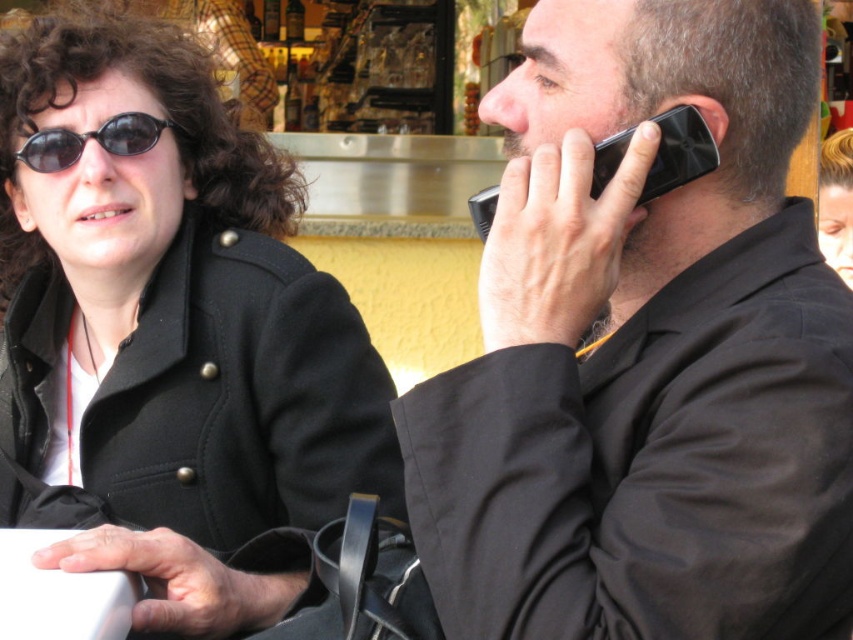
What do you see at coordinates (170, 333) in the screenshot? The height and width of the screenshot is (640, 853). I see `black wool coat at upper left` at bounding box center [170, 333].

Between black wool coat at upper left and black plastic sunglasses at upper left, which one is positioned lower?

black wool coat at upper left is below.

This screenshot has width=853, height=640. Describe the element at coordinates (170, 333) in the screenshot. I see `black wool coat at upper left` at that location.

Image resolution: width=853 pixels, height=640 pixels. Find the location of `black wool coat at upper left`. black wool coat at upper left is located at coordinates 170,333.

The width and height of the screenshot is (853, 640). Identify the location of black matte phone at right. (645, 353).

Is black plastic phone at right to the left of black plastic sunglasses at upper left from the viewer's perspective?

In fact, black plastic phone at right is to the right of black plastic sunglasses at upper left.

At what (x,y) coordinates should I click in order to perform the action: click on black plastic phone at right. Please return your answer as a coordinate pair (x, y). This screenshot has height=640, width=853. Looking at the image, I should click on (677, 152).

Measure the distance between point (489, 225) and camera.

They are 3.30 meters apart.

Find the location of `black plastic phone at right`. black plastic phone at right is located at coordinates (677, 152).